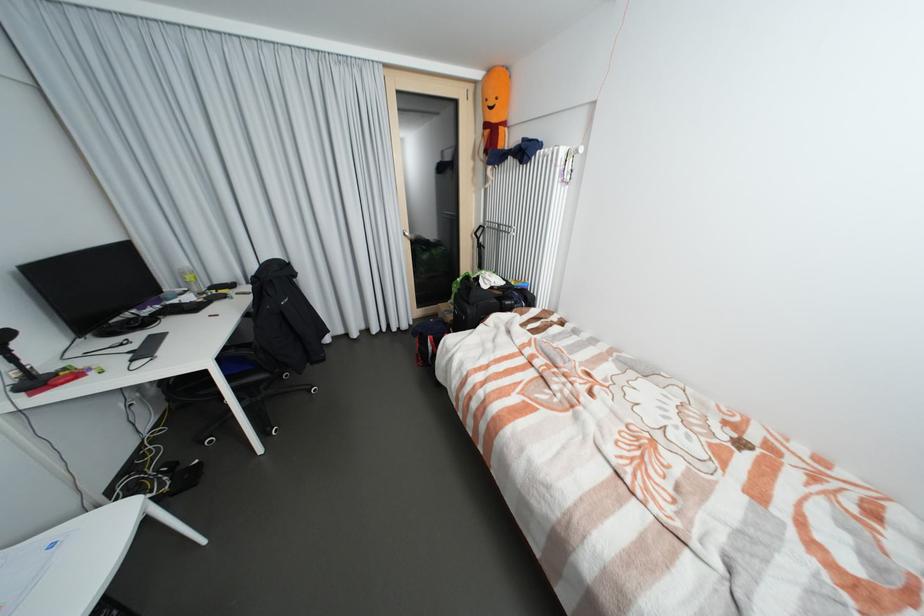
Where would you lift the plastic bottle? Please return your answer as a coordinate pair (x, y).

(189, 280)